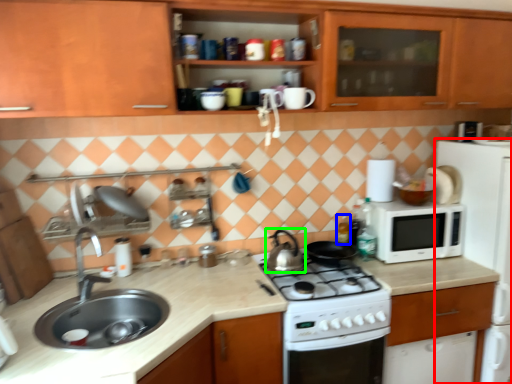
Question: Which object is positioned farthest from home appliance (highlighted by a red box)? Select from bottle (highlighted by a blue box) and kitchen appliance (highlighted by a green box).

Choices:
 (A) bottle
 (B) kitchen appliance

Answer: (B)